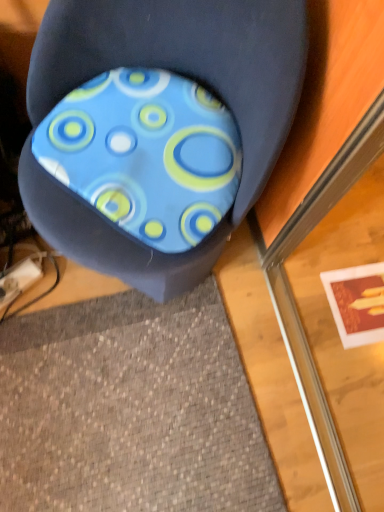
Question: Considering the relative sizes of blue fabric cushion at center and blue fabric cushion at center in the image provided, is blue fabric cushion at center bigger than blue fabric cushion at center?

Choices:
 (A) yes
 (B) no

Answer: (A)

Question: Considering the relative sizes of blue fabric cushion at center and blue fabric cushion at center in the image provided, is blue fabric cushion at center shorter than blue fabric cushion at center?

Choices:
 (A) yes
 (B) no

Answer: (B)

Question: Is blue fabric cushion at center outside blue fabric cushion at center?

Choices:
 (A) no
 (B) yes

Answer: (B)

Question: Is blue fabric cushion at center looking in the opposite direction of blue fabric cushion at center?

Choices:
 (A) no
 (B) yes

Answer: (B)

Question: Is blue fabric cushion at center in contact with blue fabric cushion at center?

Choices:
 (A) yes
 (B) no

Answer: (A)

Question: From the image's perspective, is blue fabric cushion at center located beneath blue fabric cushion at center?

Choices:
 (A) no
 (B) yes

Answer: (B)

Question: Is the depth of blue fabric cushion at center less than that of blue fabric cushion at center?

Choices:
 (A) no
 (B) yes

Answer: (A)

Question: From a real-world perspective, is blue fabric cushion at center below blue fabric cushion at center?

Choices:
 (A) yes
 (B) no

Answer: (B)

Question: Can you confirm if blue fabric cushion at center is thinner than blue fabric cushion at center?

Choices:
 (A) yes
 (B) no

Answer: (A)

Question: Is blue fabric cushion at center not near blue fabric cushion at center?

Choices:
 (A) no
 (B) yes

Answer: (A)

Question: Is blue fabric cushion at center oriented away from blue fabric cushion at center?

Choices:
 (A) yes
 (B) no

Answer: (A)

Question: Is blue fabric cushion at center bigger than blue fabric cushion at center?

Choices:
 (A) no
 (B) yes

Answer: (A)

Question: Is blue fabric cushion at center wider or thinner than blue fabric cushion at center?

Choices:
 (A) thin
 (B) wide

Answer: (B)